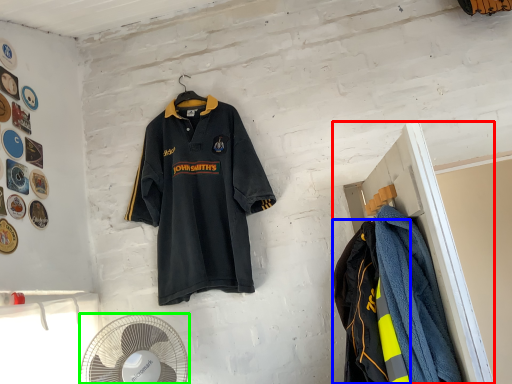
Question: Based on their relative distances, which object is nearer to closet (highlighted by a red box)? Choose from garment (highlighted by a blue box) and mechanical fan (highlighted by a green box).

Choices:
 (A) garment
 (B) mechanical fan

Answer: (A)